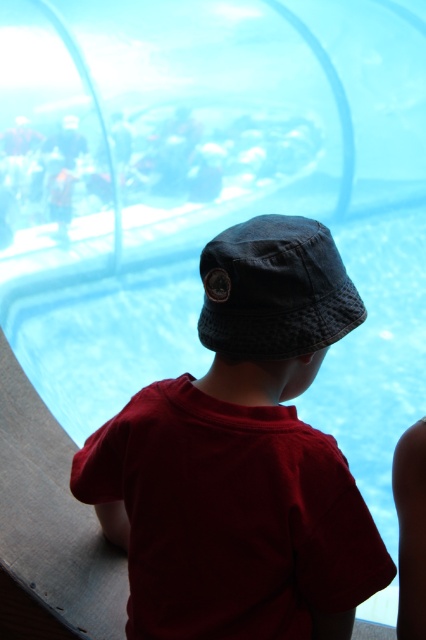
Question: Does dark blue fabric hat at center come behind denim baseball hat at center?

Choices:
 (A) no
 (B) yes

Answer: (A)

Question: Which of the following is the closest to the observer?

Choices:
 (A) (261, 317)
 (B) (327, 284)

Answer: (A)

Question: Can you confirm if dark blue fabric hat at center is positioned above denim baseball hat at center?

Choices:
 (A) no
 (B) yes

Answer: (A)

Question: Can you confirm if dark blue fabric hat at center is positioned to the left of denim baseball hat at center?

Choices:
 (A) no
 (B) yes

Answer: (B)

Question: Which of the following is the farthest from the observer?

Choices:
 (A) dark blue fabric hat at center
 (B) denim baseball hat at center

Answer: (B)